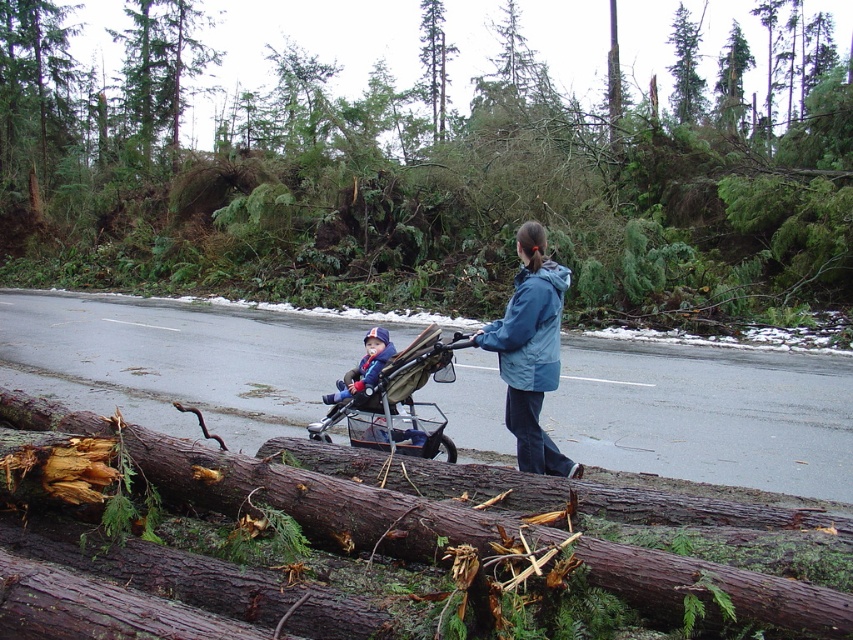
Looking at this image, you are a pedestrian trying to navigate through the blocked road in the forest. You see the brown fabric stroller at center and the blue smooth jacket at center. Which object is wider?

The brown fabric stroller at center is wider than the blue smooth jacket at center.